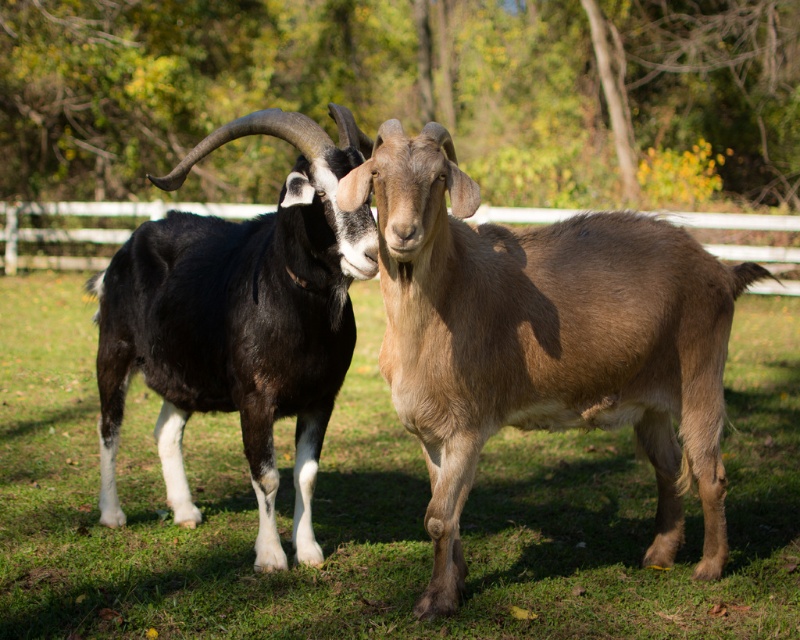
You are a farmer checking the goats in your pasture. You notice the brown woolen goat at center and the shiny black goat at left. Which goat is shorter in height?

The brown woolen goat at center is shorter than the shiny black goat at left.

You are a farmer trying to locate the brown woolen goat at center in the field. Based on the coordinates provided, can you determine its exact location relative to the fence?

The brown woolen goat at center is located at coordinates point (544, 340), which places it centrally within the field, likely near the middle of the fence perimeter.